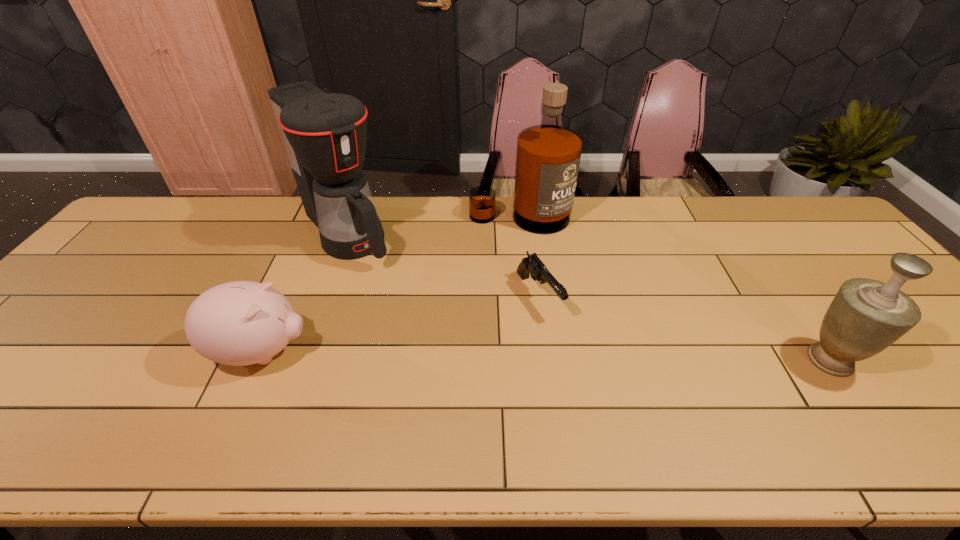
This screenshot has height=540, width=960. I want to click on urn that is at the near edge, so click(866, 316).

Image resolution: width=960 pixels, height=540 pixels. In the image, there is a desktop. What are the coordinates of `free space at the far edge` in the screenshot? It's located at (396, 197).

This screenshot has width=960, height=540. In the image, there is a desktop. Find the location of `vacant space at the near edge`. vacant space at the near edge is located at coordinates point(889,394).

Find the location of a particular element. The width and height of the screenshot is (960, 540). free space at the left edge is located at coordinates (146, 268).

Identify the location of vacant space at the far left corner of the desktop. Image resolution: width=960 pixels, height=540 pixels. (199, 204).

This screenshot has height=540, width=960. In the image, there is a desktop. Identify the location of vacant space at the near left corner. (48, 382).

At what (x,y) coordinates should I click in order to perform the action: click on vacant region at the far right corner of the desktop. Please return your answer as a coordinate pair (x, y). The width and height of the screenshot is (960, 540). Looking at the image, I should click on (810, 211).

The height and width of the screenshot is (540, 960). I want to click on unoccupied position between the second shortest object and the coffee maker, so click(304, 293).

The width and height of the screenshot is (960, 540). In order to click on unoccupied area between the urn and the shortest object in this screenshot , I will do `click(684, 328)`.

Find the location of a particular element. free space between the coffee maker and the liquor is located at coordinates (433, 226).